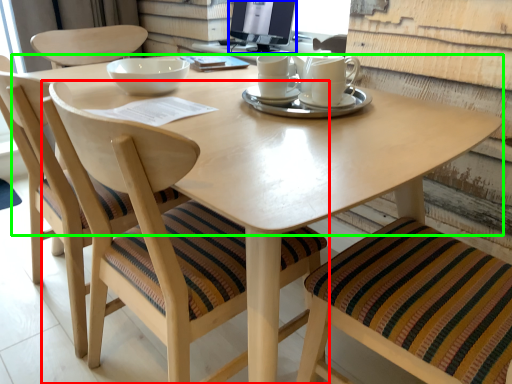
Question: Which is nearer to the chair (highlighted by a red box)? computer monitor (highlighted by a blue box) or round table (highlighted by a green box).

Choices:
 (A) computer monitor
 (B) round table

Answer: (B)